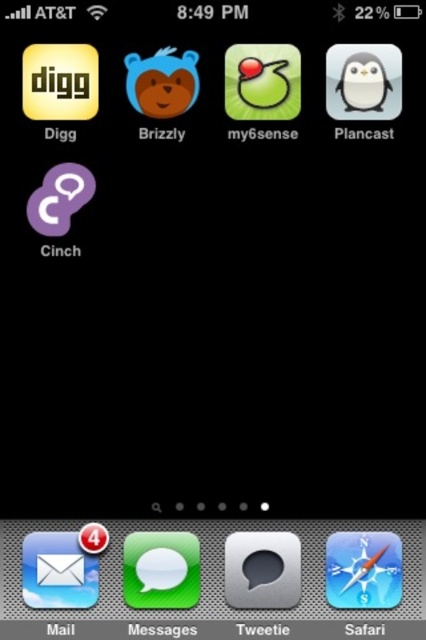
Looking at this image, can you confirm if metallic gray speech bubble at center is shorter than green rubber duck at center?

Indeed, metallic gray speech bubble at center has a lesser height compared to green rubber duck at center.

Does point (299, 563) come farther from viewer compared to point (282, 97)?

No.

Where is `metallic gray speech bubble at center`? The width and height of the screenshot is (426, 640). metallic gray speech bubble at center is located at coordinates (261, 570).

Can you confirm if green rubber duck at center is positioned below matte plastic bear at upper center?

Indeed, green rubber duck at center is positioned under matte plastic bear at upper center.

In the scene shown: Who is more distant from viewer, (258,48) or (190,56)?

Point (190,56)

Describe the element at coordinates (262, 81) in the screenshot. I see `green rubber duck at center` at that location.

The width and height of the screenshot is (426, 640). I want to click on green rubber duck at center, so click(262, 81).

Looking at this image, between metallic gray speech bubble at center and matte plastic bear at upper center, which one has less height?

With less height is matte plastic bear at upper center.

Can you confirm if metallic gray speech bubble at center is positioned above matte plastic bear at upper center?

Incorrect, metallic gray speech bubble at center is not positioned above matte plastic bear at upper center.

At what (x,y) coordinates should I click in order to perform the action: click on metallic gray speech bubble at center. Please return your answer as a coordinate pair (x, y). Looking at the image, I should click on (261, 570).